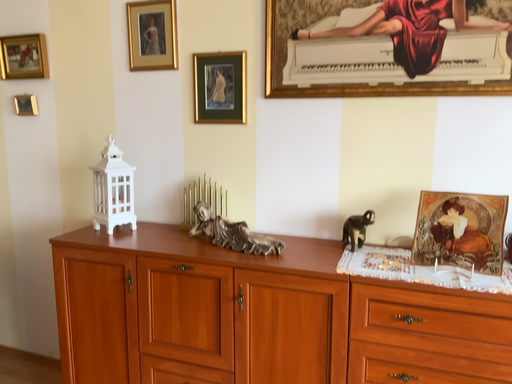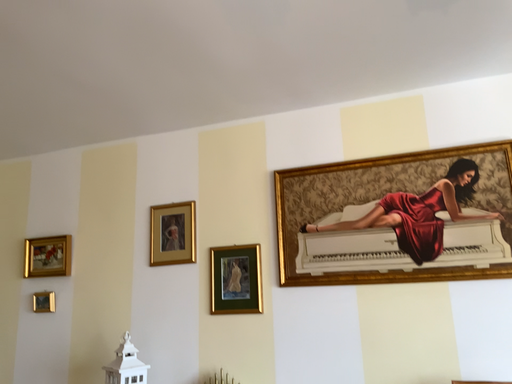
Question: How did the camera likely rotate when shooting the video?

Choices:
 (A) rotated upward
 (B) rotated downward

Answer: (A)